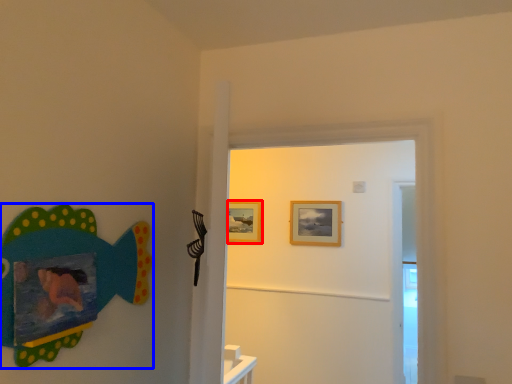
Question: Which object is further to the camera taking this photo, picture frame (highlighted by a red box) or fish (highlighted by a blue box)?

Choices:
 (A) picture frame
 (B) fish

Answer: (A)